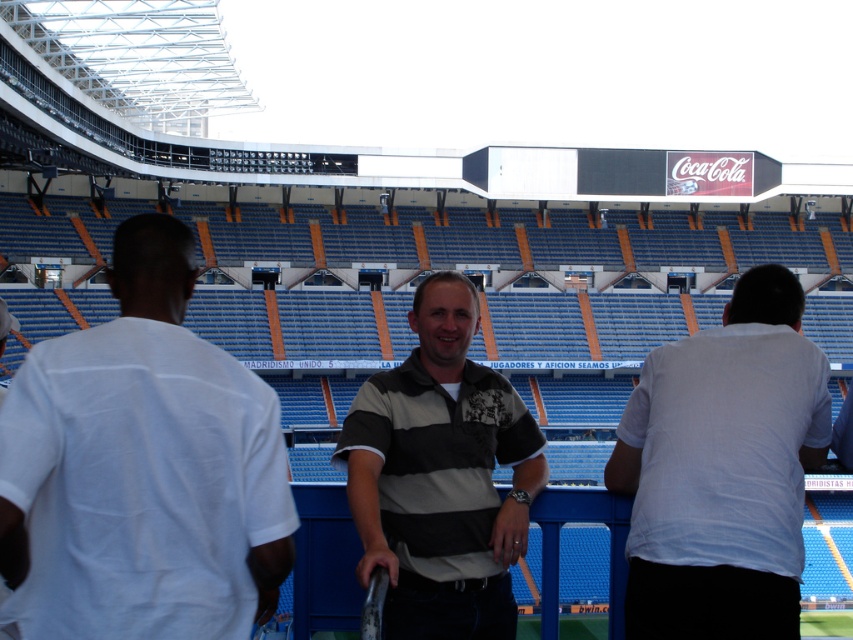
You are a photographer standing at the camera position. You want to take a photo of the white cotton shirt at center. Can you capture it in your current position?

The white cotton shirt at center is 22.73 meters from camera, so yes, you can capture it in your current position as it is within the camera range.